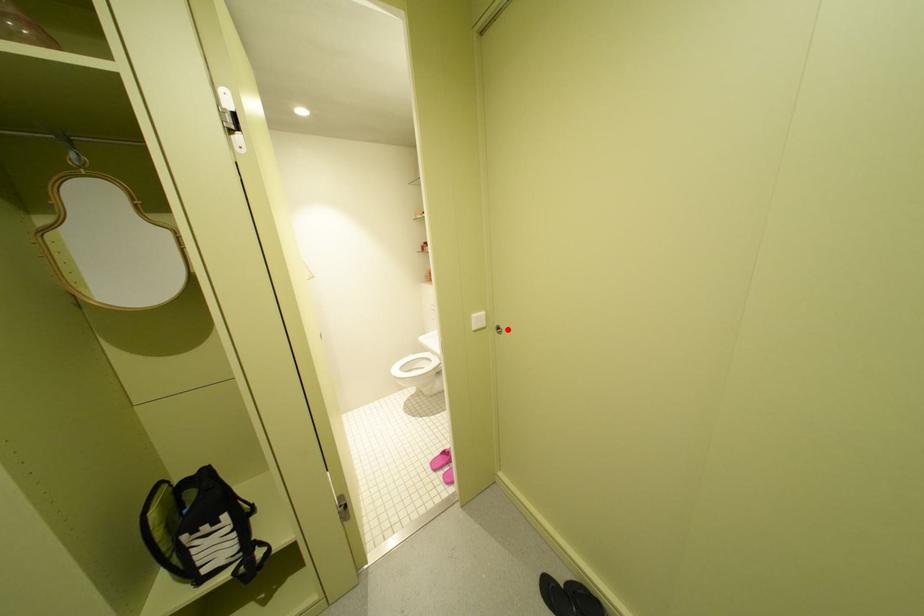
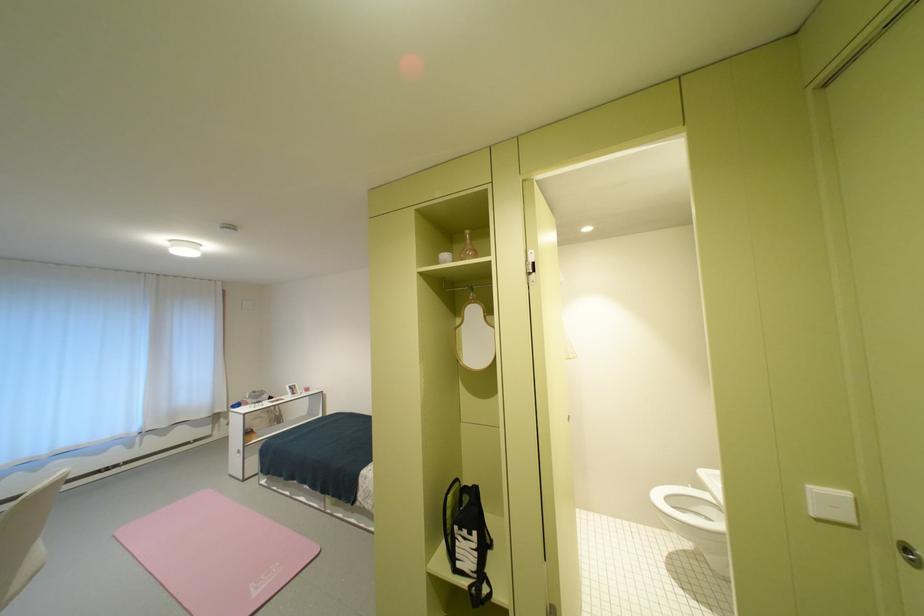
Where in the second image is the point corresponding to the highlighted location from the first image?

(917, 551)